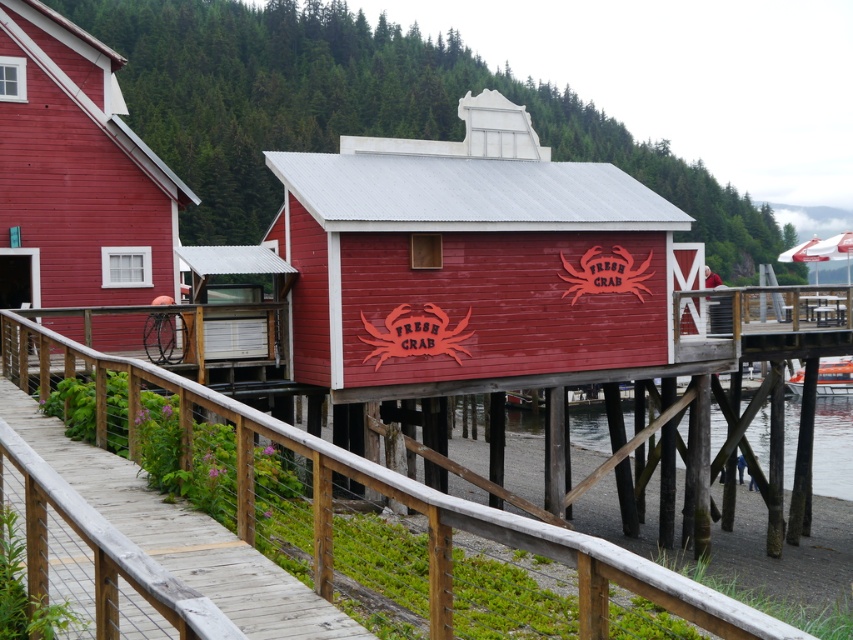
Question: Does smooth red wood hut at center have a smaller size compared to wooden at center?

Choices:
 (A) no
 (B) yes

Answer: (B)

Question: Can you confirm if matte wood hut at center is positioned to the right of metallic orange boat at lower right?

Choices:
 (A) yes
 (B) no

Answer: (B)

Question: Which object appears farthest from the camera in this image?

Choices:
 (A) wooden at center
 (B) transparent water at lower center
 (C) metallic orange boat at lower right
 (D) smooth red wood hut at center

Answer: (C)

Question: Which point appears closest to the camera in this image?

Choices:
 (A) pos(538,435)
 (B) pos(821,358)

Answer: (A)

Question: Which of these objects is positioned farthest from the metallic orange boat at lower right?

Choices:
 (A) transparent water at lower center
 (B) wooden at center
 (C) smooth red wood hut at center
 (D) matte wood hut at center

Answer: (B)

Question: From the image, what is the correct spatial relationship of smooth red wood hut at center in relation to metallic orange boat at lower right?

Choices:
 (A) left
 (B) right

Answer: (A)